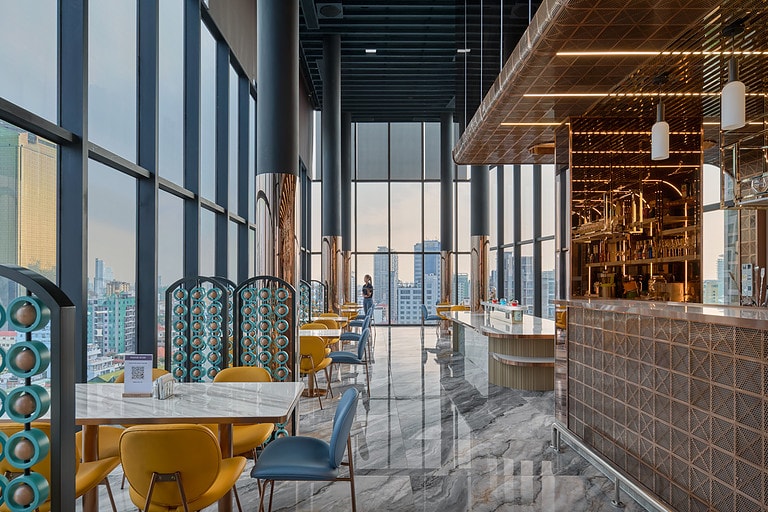
The width and height of the screenshot is (768, 512). Identify the location of window shades. (438, 172), (372, 161), (319, 159), (300, 140), (233, 26).